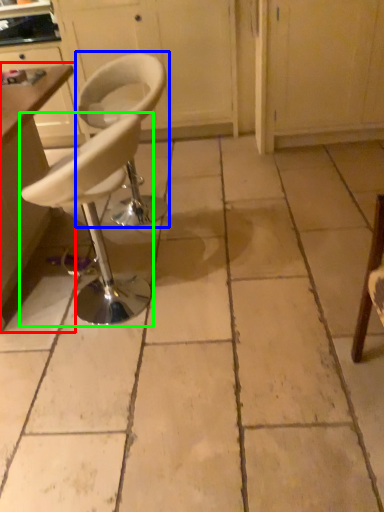
Question: Considering the real-world distances, which object is closest to table (highlighted by a red box)? chair (highlighted by a blue box) or chair (highlighted by a green box).

Choices:
 (A) chair
 (B) chair

Answer: (B)